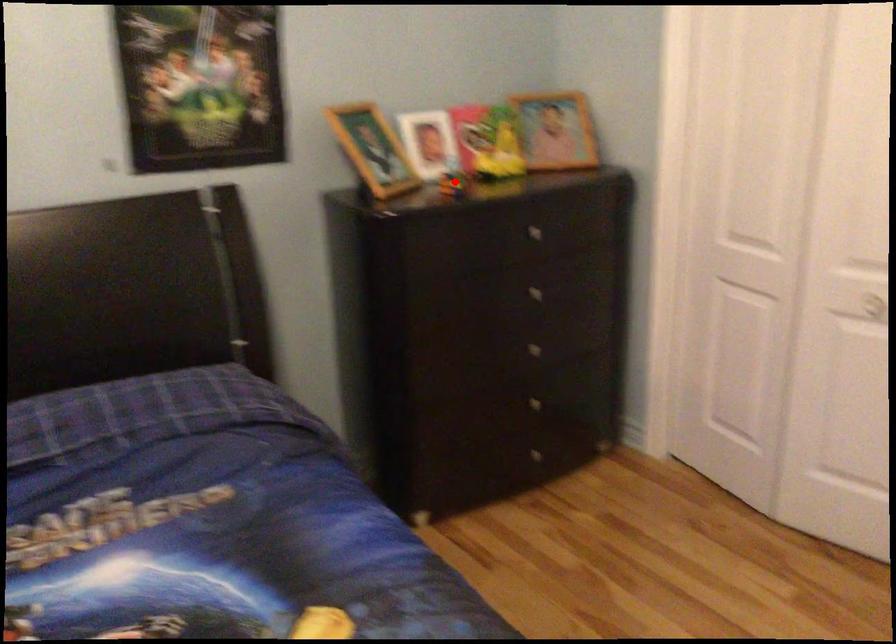
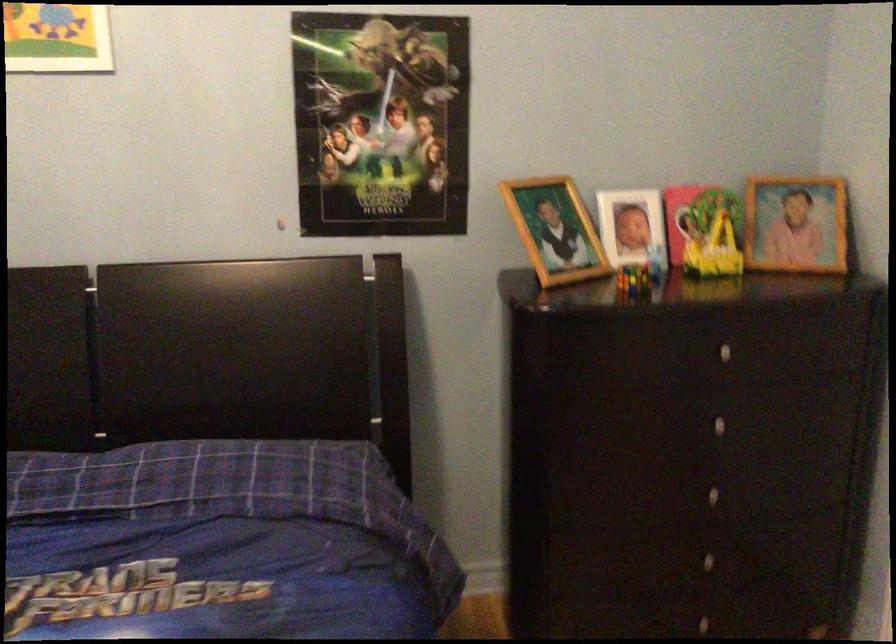
Question: I am providing you with two images of the same scene from different viewpoints. Given a red point in image1, look at the same physical point in image2. Is it:

Choices:
 (A) Closer to the viewpoint
 (B) Farther from the viewpoint

Answer: (A)